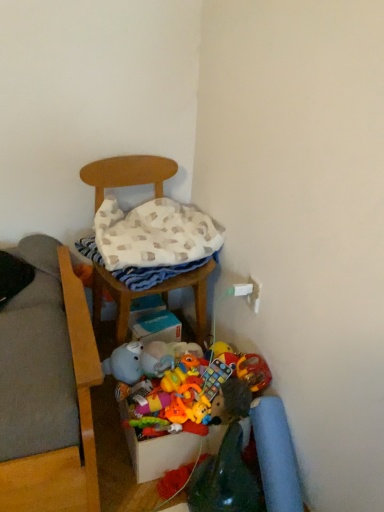
Question: From a real-world perspective, is soft plush toy at center physically located above or below wooden chair at center?

Choices:
 (A) below
 (B) above

Answer: (A)

Question: Considering the positions of soft plush toy at center and wooden chair at center in the image, is soft plush toy at center taller or shorter than wooden chair at center?

Choices:
 (A) tall
 (B) short

Answer: (B)

Question: Which is nearer to the wooden chair at center?

Choices:
 (A) multicolored fabric storage box at lower center
 (B) soft plush toy at center

Answer: (B)

Question: Which object is the farthest from the multicolored fabric storage box at lower center?

Choices:
 (A) soft plush toy at center
 (B) wooden chair at center

Answer: (B)